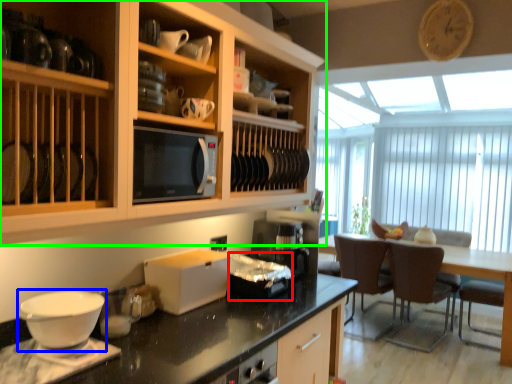
Question: Based on their relative distances, which object is nearer to appliance (highlighted by a red box)? Choose from coffee cup (highlighted by a blue box) and cabinetry (highlighted by a green box).

Choices:
 (A) coffee cup
 (B) cabinetry

Answer: (B)